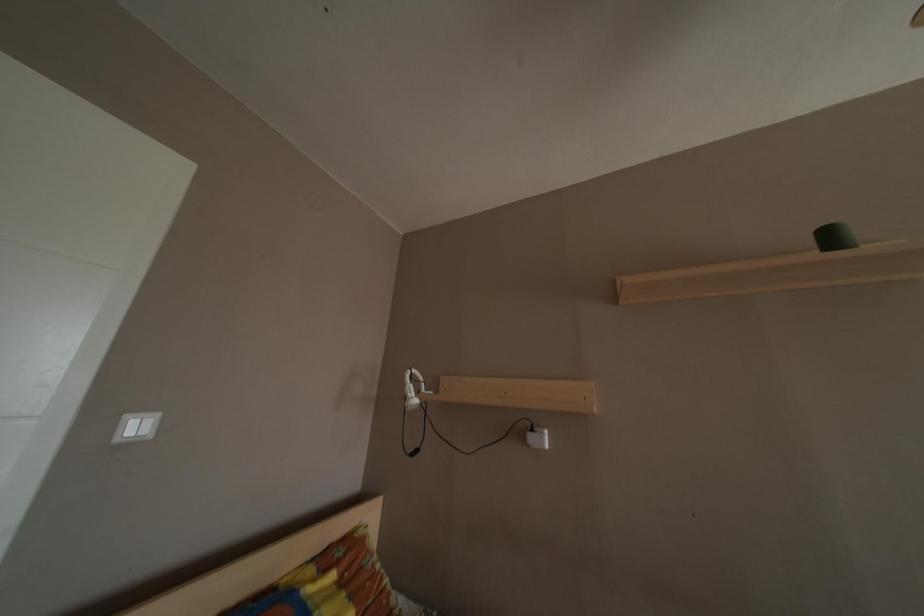
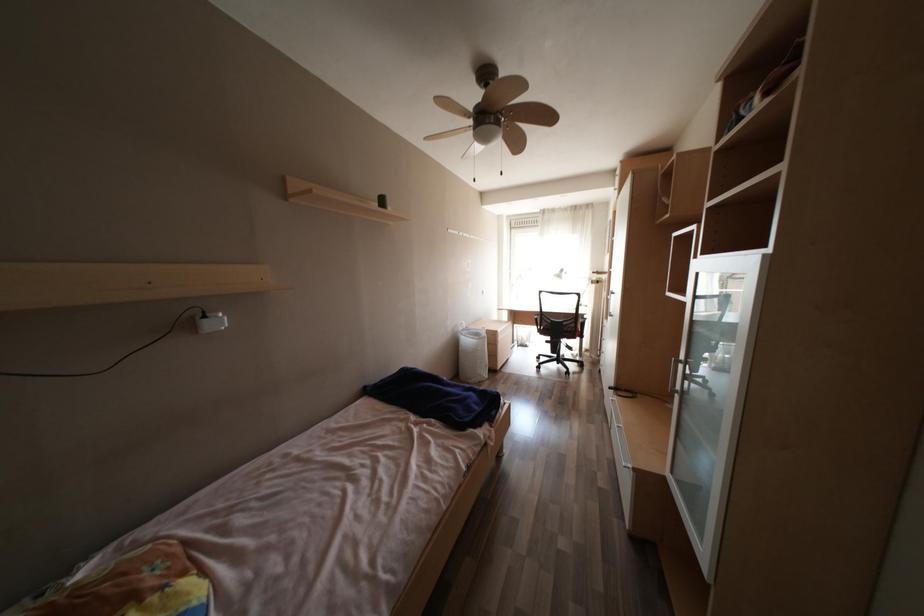
Question: How did the camera likely rotate?

Choices:
 (A) Left
 (B) Right
 (C) Up
 (D) Down

Answer: (B)